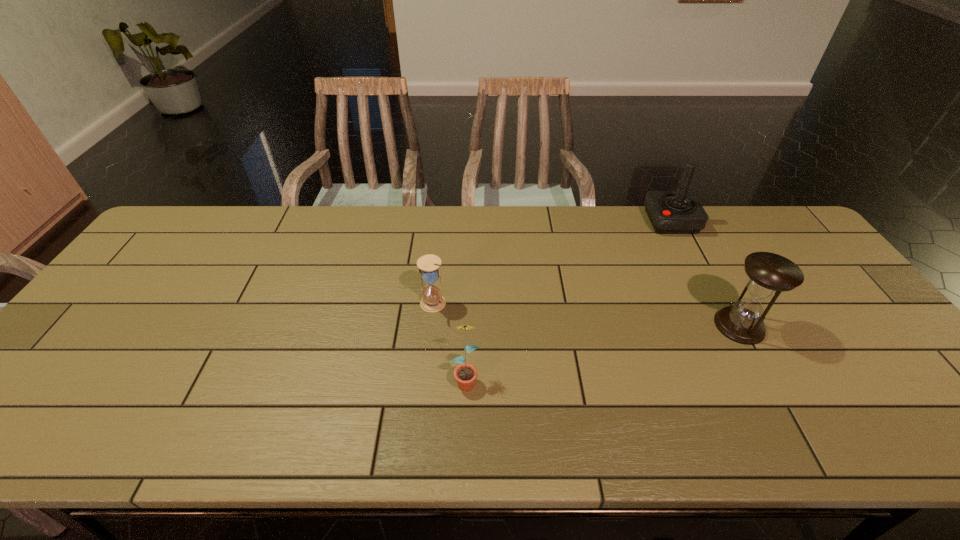
Identify the location of blank region between the right hourglass and the third object from right to left. pyautogui.click(x=603, y=352).

Where is `free space between the taller hourglass and the joystick`? The width and height of the screenshot is (960, 540). free space between the taller hourglass and the joystick is located at coordinates (706, 273).

Locate an element on the screen. This screenshot has width=960, height=540. vacant point located between the joystick and the shorter hourglass is located at coordinates (552, 263).

Locate an element on the screen. The width and height of the screenshot is (960, 540). free spot between the left hourglass and the right hourglass is located at coordinates (587, 315).

Identify the location of vacant area that lies between the nearest object and the joystick. (568, 300).

You are a GUI agent. You are given a task and a screenshot of the screen. Output one action in this format:
    pyautogui.click(x=<x>, y=<y>)
    Task: Click on the free space that is in between the leftmost object and the right hourglass
    Image resolution: width=960 pixels, height=540 pixels.
    Given the screenshot: What is the action you would take?
    pos(587,315)

The width and height of the screenshot is (960, 540). What are the coordinates of `vacant area that lies between the third object from right to left and the joystick` in the screenshot? It's located at (568, 300).

Find the location of a particular element. The width and height of the screenshot is (960, 540). free space that is in between the farthest object and the right hourglass is located at coordinates (706, 273).

Find the location of a particular element. The width and height of the screenshot is (960, 540). empty space between the right hourglass and the joystick is located at coordinates (706, 273).

What are the coordinates of `vacant region between the right hourglass and the leftmost object` in the screenshot? It's located at (587, 315).